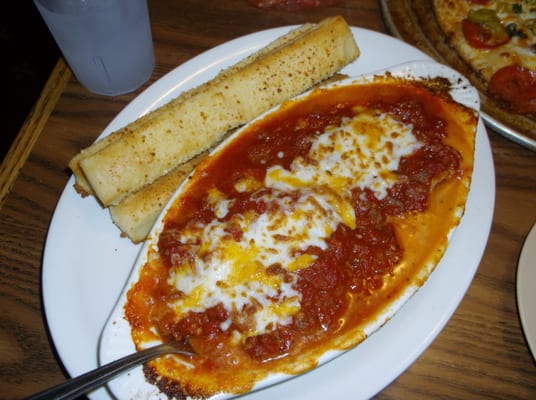
In order to click on wood table in this screenshot , I will do `click(471, 305)`.